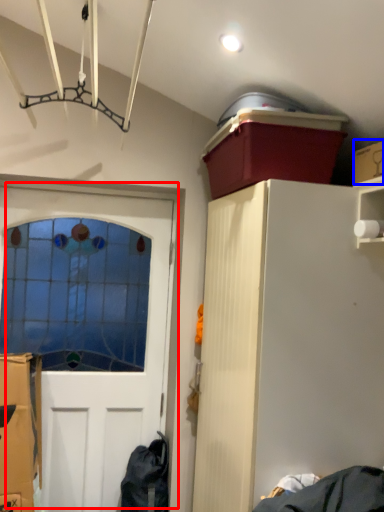
Question: Which point is closer to the camera, door (highlighted by a red box) or cardboard box (highlighted by a blue box)?

Choices:
 (A) door
 (B) cardboard box

Answer: (B)